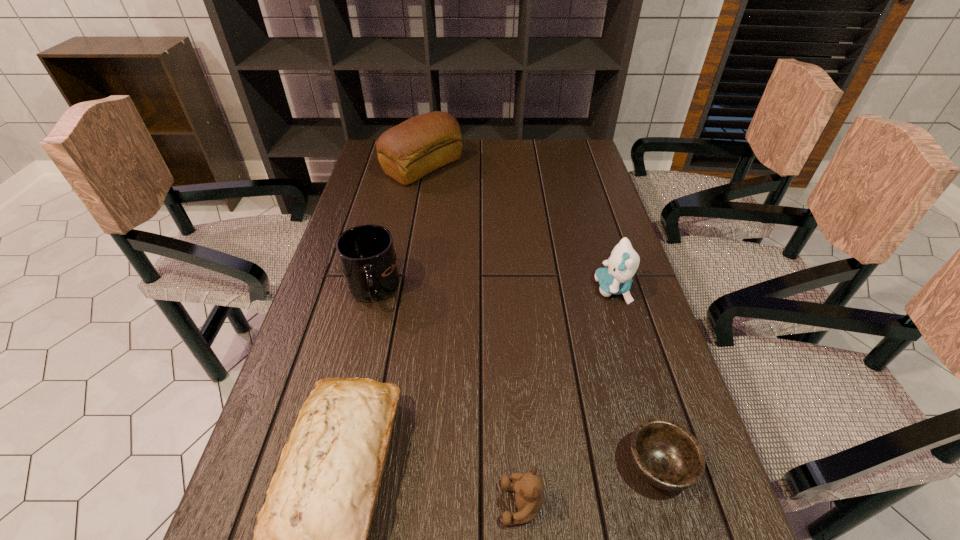
The width and height of the screenshot is (960, 540). I want to click on free space located 0.240m on the face of the kitten, so click(501, 289).

I want to click on vacant position located 0.280m with the handle on the side of the mug, so click(340, 425).

The height and width of the screenshot is (540, 960). What are the coordinates of `vacant space positioned on the front-facing side of the teddy bear` in the screenshot? It's located at (368, 504).

What are the coordinates of `vacant space located 0.290m on the front-facing side of the teddy bear` in the screenshot? It's located at (332, 504).

Locate an element on the screen. The width and height of the screenshot is (960, 540). vacant space located on the front-facing side of the teddy bear is located at coordinates (269, 504).

In order to click on vacant space located 0.300m on the left of the bowl in this screenshot , I will do [461, 465].

Image resolution: width=960 pixels, height=540 pixels. I want to click on object that is at the far edge, so click(x=407, y=152).

The height and width of the screenshot is (540, 960). In order to click on bread situated at the left edge in this screenshot , I will do `click(407, 152)`.

The image size is (960, 540). I want to click on mug at the left edge, so click(366, 253).

Identify the location of kitten located in the right edge section of the desktop. (623, 262).